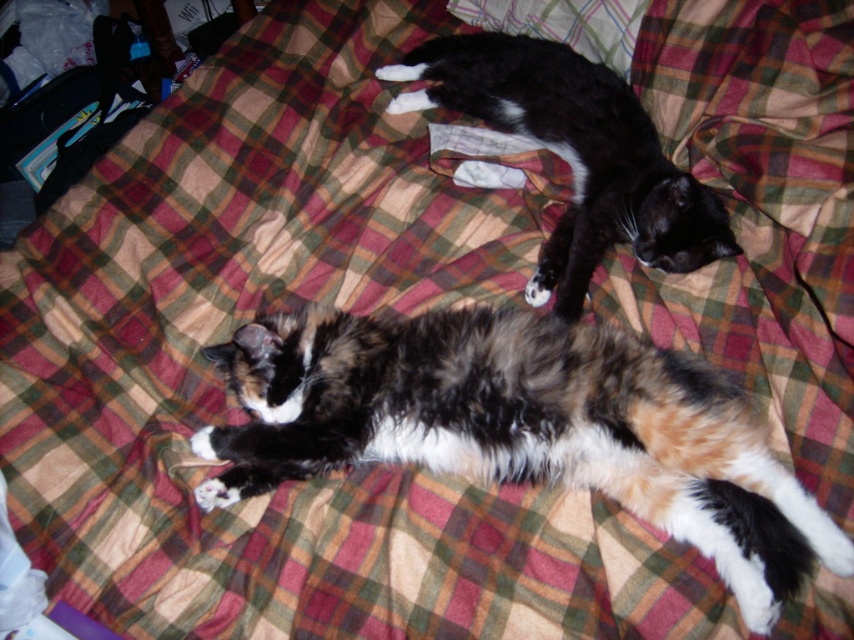
Question: Which point is farther from the camera taking this photo?

Choices:
 (A) (583, 106)
 (B) (560, 369)

Answer: (A)

Question: Is calico fur cat at center thinner than black fur cat at upper center?

Choices:
 (A) yes
 (B) no

Answer: (B)

Question: Is calico fur cat at center smaller than black fur cat at upper center?

Choices:
 (A) no
 (B) yes

Answer: (B)

Question: Observing the image, what is the correct spatial positioning of calico fur cat at center in reference to black fur cat at upper center?

Choices:
 (A) above
 (B) below

Answer: (B)

Question: Which point is closer to the camera taking this photo?

Choices:
 (A) (691, 218)
 (B) (670, 509)

Answer: (B)